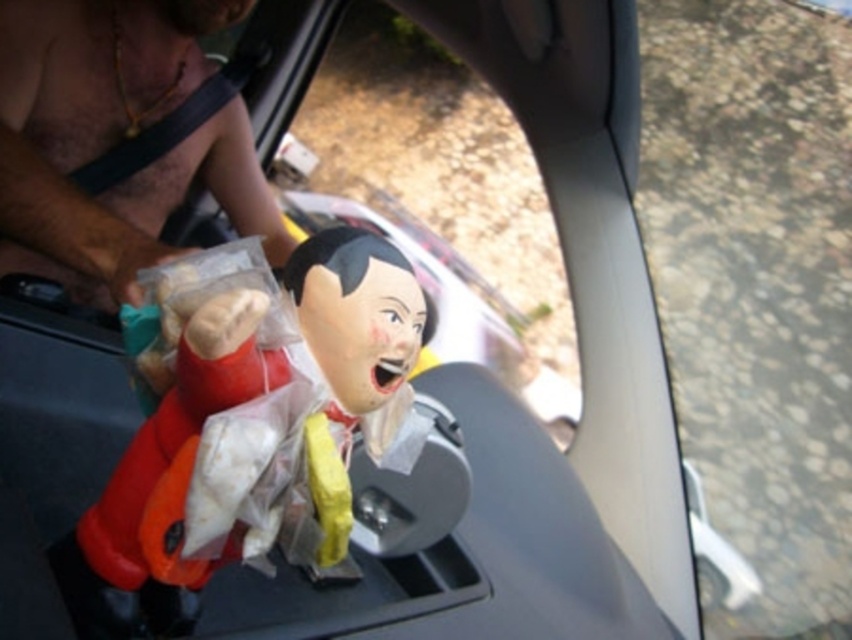
Question: Can you confirm if transparent plastic doll at center is wider than shiny skin at left?

Choices:
 (A) yes
 (B) no

Answer: (A)

Question: Is matte plastic doll at center to the right of shiny skin at left from the viewer's perspective?

Choices:
 (A) no
 (B) yes

Answer: (B)

Question: Which point is closer to the camera?

Choices:
 (A) (570, 339)
 (B) (110, 189)

Answer: (B)

Question: Can you confirm if matte plastic doll at center is positioned to the left of transparent plastic doll at center?

Choices:
 (A) yes
 (B) no

Answer: (A)

Question: Which point appears farthest from the camera in this image?

Choices:
 (A) (321, 365)
 (B) (337, 4)

Answer: (B)

Question: Among these objects, which one is nearest to the camera?

Choices:
 (A) shiny skin at left
 (B) matte plastic doll at center
 (C) transparent plastic doll at center

Answer: (B)